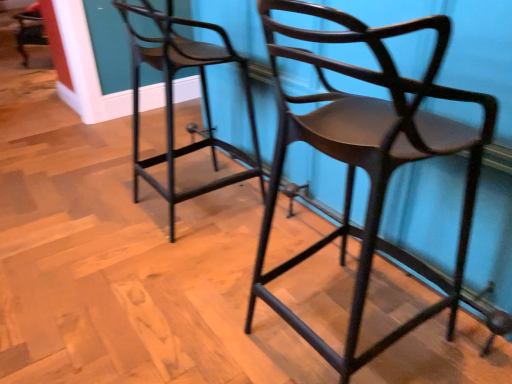
Question: Based on their sizes in the image, would you say matte dark wood chair at center, which is counted as the second chair, starting from the left, is bigger or smaller than matte black stool at center, positioned as the 1th chair in left-to-right order?

Choices:
 (A) big
 (B) small

Answer: (A)

Question: Does point (442, 307) appear closer or farther from the camera than point (181, 41)?

Choices:
 (A) farther
 (B) closer

Answer: (B)

Question: In the image, is matte dark wood chair at center, the 1th chair viewed from the right, on the left side or the right side of matte black stool at center, the 2th chair positioned from the right?

Choices:
 (A) left
 (B) right

Answer: (B)

Question: From their relative heights in the image, would you say matte black stool at center, positioned as the 1th chair in left-to-right order, is taller or shorter than matte dark wood chair at center, the 1th chair viewed from the right?

Choices:
 (A) tall
 (B) short

Answer: (B)

Question: Based on their sizes in the image, would you say matte black stool at center, positioned as the 1th chair in left-to-right order, is bigger or smaller than matte dark wood chair at center, the 1th chair viewed from the right?

Choices:
 (A) big
 (B) small

Answer: (B)

Question: In terms of width, does matte black stool at center, the 2th chair positioned from the right, look wider or thinner when compared to matte dark wood chair at center, which is counted as the second chair, starting from the left?

Choices:
 (A) wide
 (B) thin

Answer: (B)

Question: Is point (230, 180) closer or farther from the camera than point (388, 135)?

Choices:
 (A) farther
 (B) closer

Answer: (A)